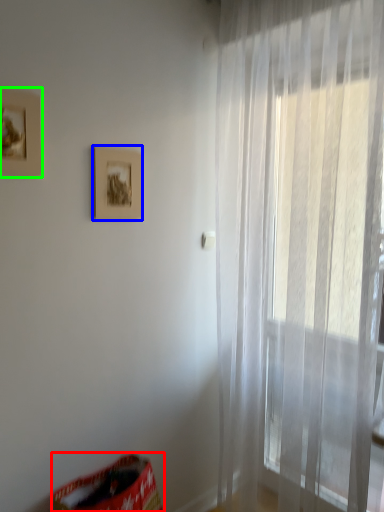
Question: Which object is the closest to the bean bag chair (highlighted by a red box)? Choose among these: picture frame (highlighted by a blue box) or picture frame (highlighted by a green box).

Choices:
 (A) picture frame
 (B) picture frame

Answer: (A)